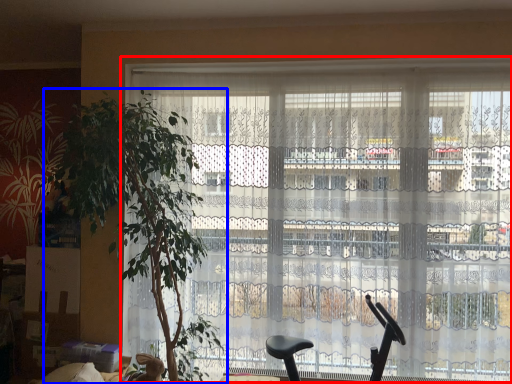
Question: Among these objects, which one is nearest to the camera, window (highlighted by a red box) or houseplant (highlighted by a blue box)?

Choices:
 (A) window
 (B) houseplant

Answer: (B)